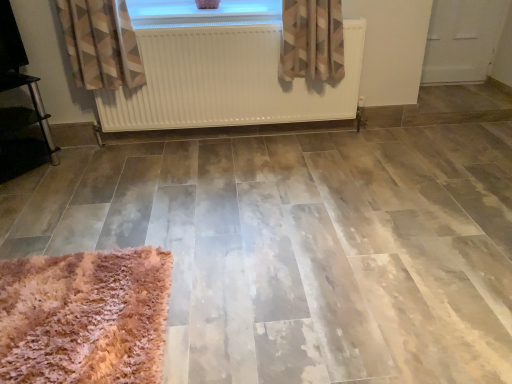
Where is `transparent glass window at upper center`? The width and height of the screenshot is (512, 384). transparent glass window at upper center is located at coordinates (202, 12).

At what (x,y) coordinates should I click in order to perform the action: click on white matte radiator at upper center. Please return your answer as a coordinate pair (x, y). The height and width of the screenshot is (384, 512). Looking at the image, I should click on (227, 80).

From the image's perspective, is fuzzy pink rug at lower left beneath white matte radiator at upper center?

Yes, from the image's perspective, fuzzy pink rug at lower left is beneath white matte radiator at upper center.

Consider the image. Which of these two, fuzzy pink rug at lower left or white matte radiator at upper center, is wider?

fuzzy pink rug at lower left is wider.

What are the coordinates of `radiator behind the fuzzy pink rug at lower left` in the screenshot? It's located at (227, 80).

Looking at this image, are fuzzy pink rug at lower left and white matte radiator at upper center located far from each other?

Yes, fuzzy pink rug at lower left is far from white matte radiator at upper center.

Does point (246, 112) lie behind point (70, 364)?

Yes.

Is white matte radiator at upper center aimed at fuzzy pink rug at lower left?

Yes, white matte radiator at upper center is turned towards fuzzy pink rug at lower left.

Which object is positioned more to the left, fuzzy pink rug at lower left or transparent glass window at upper center?

fuzzy pink rug at lower left is more to the left.

Between fuzzy pink rug at lower left and transparent glass window at upper center, which one is positioned behind?

transparent glass window at upper center is behind.

Is point (132, 324) closer or farther from the camera than point (169, 15)?

Point (132, 324) is positioned closer to the camera compared to point (169, 15).

From a real-world perspective, is fuzzy pink rug at lower left physically above transparent glass window at upper center?

No, from a real-world perspective, fuzzy pink rug at lower left is not over transparent glass window at upper center

Considering the relative positions of transparent glass window at upper center and fuzzy pink rug at lower left in the image provided, is transparent glass window at upper center to the left or to the right of fuzzy pink rug at lower left?

In the image, transparent glass window at upper center appears on the right side of fuzzy pink rug at lower left.

Is transparent glass window at upper center completely or partially outside of fuzzy pink rug at lower left?

Yes, transparent glass window at upper center is outside of fuzzy pink rug at lower left.

Considering the relative sizes of transparent glass window at upper center and fuzzy pink rug at lower left in the image provided, is transparent glass window at upper center smaller than fuzzy pink rug at lower left?

Yes.

Is transparent glass window at upper center aimed at fuzzy pink rug at lower left?

No, transparent glass window at upper center is not oriented towards fuzzy pink rug at lower left.

Is white matte radiator at upper center far away from transparent glass window at upper center?

No.

Based on their sizes in the image, would you say white matte radiator at upper center is bigger or smaller than transparent glass window at upper center?

Considering their sizes, white matte radiator at upper center takes up more space than transparent glass window at upper center.

Which point is more forward, [307,109] or [152,19]?

Point [152,19]

From a real-world perspective, which is physically above, white matte radiator at upper center or transparent glass window at upper center?

transparent glass window at upper center, from a real-world perspective.

Is transparent glass window at upper center situated inside white matte radiator at upper center or outside?

The correct answer is: outside.

From the picture: Between transparent glass window at upper center and white matte radiator at upper center, which one is positioned behind?

Positioned behind is transparent glass window at upper center.

Is transparent glass window at upper center not close to white matte radiator at upper center?

No, transparent glass window at upper center is not far away from white matte radiator at upper center.

From the image's perspective, which one is positioned lower, transparent glass window at upper center or white matte radiator at upper center?

white matte radiator at upper center is shown below in the image.

The height and width of the screenshot is (384, 512). What are the coordinates of `mat on the left of white matte radiator at upper center` in the screenshot? It's located at (84, 317).

The height and width of the screenshot is (384, 512). Find the location of `mat below the white matte radiator at upper center (from a real-world perspective)`. mat below the white matte radiator at upper center (from a real-world perspective) is located at coordinates (84, 317).

From the image, which object appears to be nearer to white matte radiator at upper center, transparent glass window at upper center or fuzzy pink rug at lower left?

The object closer to white matte radiator at upper center is transparent glass window at upper center.

When comparing their distances from fuzzy pink rug at lower left, does white matte radiator at upper center or transparent glass window at upper center seem closer?

white matte radiator at upper center.

Looking at the image, which one is located further to transparent glass window at upper center, fuzzy pink rug at lower left or white matte radiator at upper center?

fuzzy pink rug at lower left is further to transparent glass window at upper center.

Which object lies further to the anchor point fuzzy pink rug at lower left, transparent glass window at upper center or white matte radiator at upper center?

Based on the image, transparent glass window at upper center appears to be further to fuzzy pink rug at lower left.

Which object lies further to the anchor point white matte radiator at upper center, fuzzy pink rug at lower left or transparent glass window at upper center?

The object further to white matte radiator at upper center is fuzzy pink rug at lower left.

Considering their positions, is white matte radiator at upper center positioned closer to transparent glass window at upper center than fuzzy pink rug at lower left?

white matte radiator at upper center is positioned closer to the anchor transparent glass window at upper center.

Identify the location of radiator between transparent glass window at upper center and fuzzy pink rug at lower left from top to bottom. (227, 80).